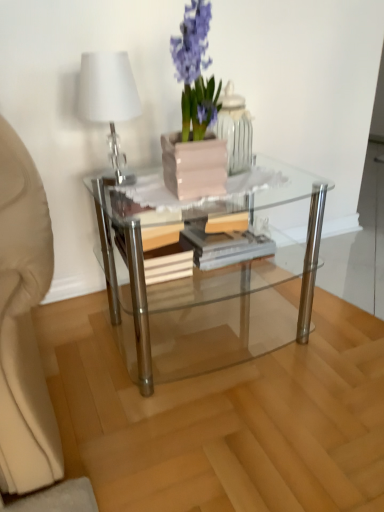
Question: Is pink glossy vase at upper center taller or shorter than transparent glass coffee table at center?

Choices:
 (A) tall
 (B) short

Answer: (B)

Question: Is pink glossy vase at upper center wider or thinner than transparent glass coffee table at center?

Choices:
 (A) wide
 (B) thin

Answer: (B)

Question: Which is nearer to the white glossy table lamp at upper left?

Choices:
 (A) transparent glass coffee table at center
 (B) pink glossy vase at upper center
 (C) wooden at center
 (D) matte pink pot at center

Answer: (D)

Question: Based on their relative distances, which object is nearer to the wooden at center?

Choices:
 (A) white glossy table lamp at upper left
 (B) transparent glass coffee table at center
 (C) pink glossy vase at upper center
 (D) matte pink pot at center

Answer: (B)